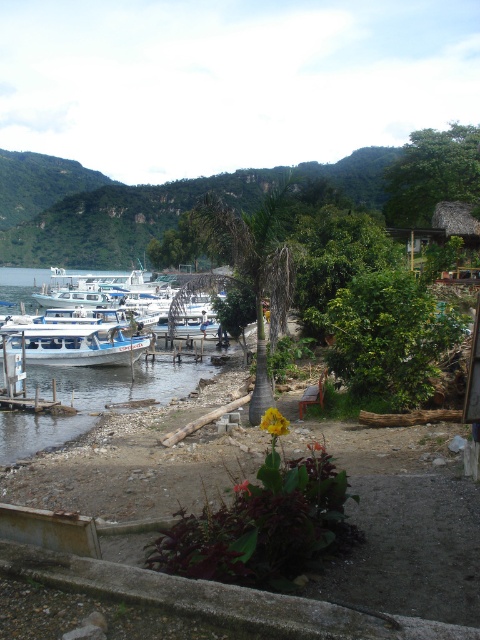
You are planning to move the white glossy boat at lower left to the wooden bench at lower center. Considering their sizes, will the boat fit on the bench without overlapping its edges?

The white glossy boat at lower left is narrower than the wooden bench at lower center, so it can fit without overlapping the edges.

You are a tour guide leading a group of visitors to the wooden bench at lower center. The group wants to know how far they need to walk from the white glossy boat at lower left to reach the bench. What do you tell them?

The distance between the white glossy boat at lower left and the wooden bench at lower center is 61.52 feet, so the group needs to walk 61.52 feet to reach the bench.

Looking at this image, you are a visitor at the harbor and want to sit on the wooden bench at lower center. Can you walk directly to it from your current position without moving around the white glossy boat at lower left?

The wooden bench at lower center is behind the white glossy boat at lower left, so you would need to move around the white glossy boat at lower left to reach it.